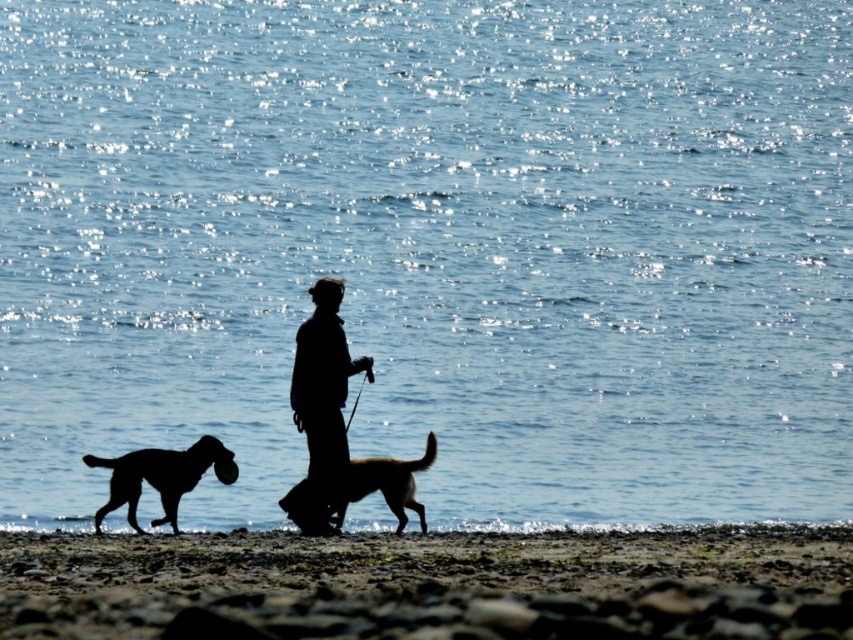
Question: Observing the image, what is the correct spatial positioning of silhouette fabric at center in reference to silhouette glossy dog at lower left?

Choices:
 (A) below
 (B) above

Answer: (B)

Question: Is rough sand beach at lower center wider than silhouette glossy dog at lower left?

Choices:
 (A) yes
 (B) no

Answer: (A)

Question: Which object is the closest to the rough sand beach at lower center?

Choices:
 (A) silhouette glossy dog at lower left
 (B) brown fur dog at center
 (C) silhouette fabric at center

Answer: (B)

Question: Does rough sand beach at lower center appear on the left side of silhouette fabric at center?

Choices:
 (A) no
 (B) yes

Answer: (A)

Question: Estimate the real-world distances between objects in this image. Which object is farther from the rough sand beach at lower center?

Choices:
 (A) brown fur dog at center
 (B) silhouette fabric at center
 (C) silhouette glossy dog at lower left

Answer: (B)

Question: Which of the following is the closest to the observer?

Choices:
 (A) rough sand beach at lower center
 (B) silhouette glossy dog at lower left
 (C) silhouette fabric at center

Answer: (A)